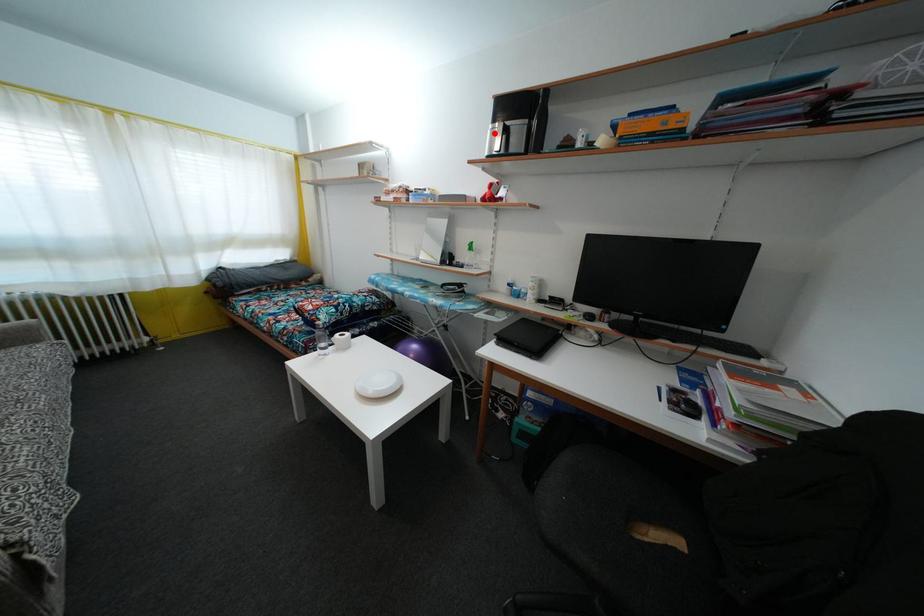
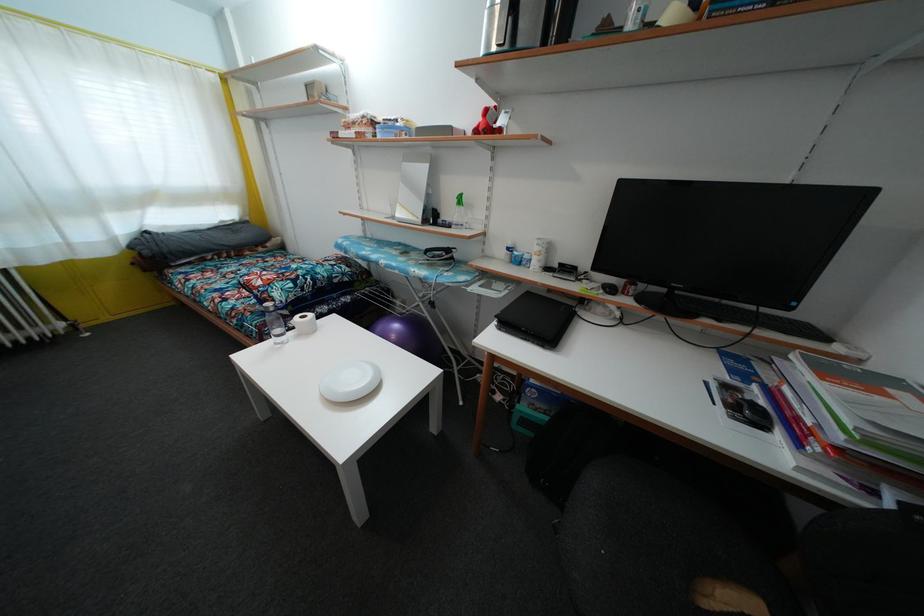
Where in the second image is the point corresponding to the highlighted location from the first image?

(492, 10)